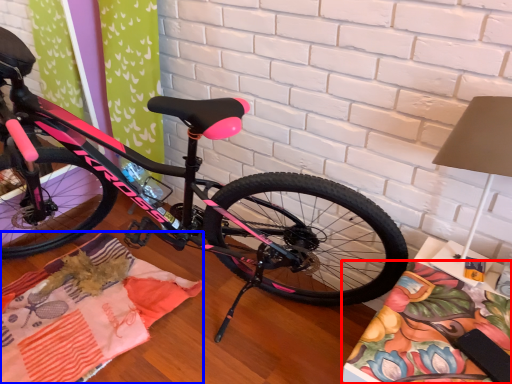
Question: Which object is closer to the camera taking this photo, blanket (highlighted by a red box) or blanket (highlighted by a blue box)?

Choices:
 (A) blanket
 (B) blanket

Answer: (A)